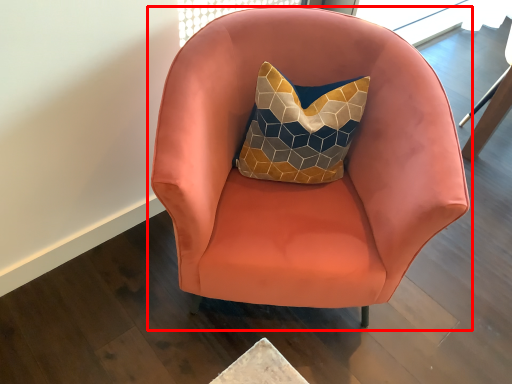
Question: Considering the relative positions of chair (annotated by the red box) and swivel chair in the image provided, where is chair (annotated by the red box) located with respect to the staircase?

Choices:
 (A) right
 (B) left

Answer: (B)